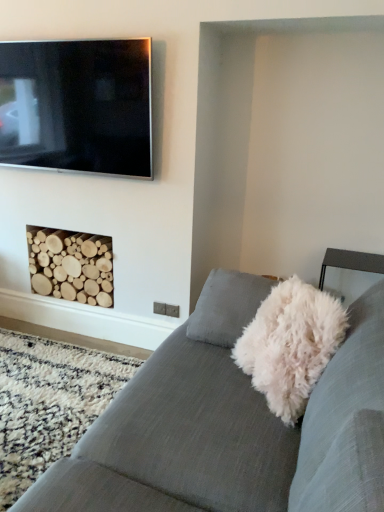
Question: From the image's perspective, is natural wood logs at lower left over flat screen tv at upper left?

Choices:
 (A) no
 (B) yes

Answer: (A)

Question: Is natural wood logs at lower left shorter than flat screen tv at upper left?

Choices:
 (A) no
 (B) yes

Answer: (B)

Question: Is natural wood logs at lower left aimed at flat screen tv at upper left?

Choices:
 (A) yes
 (B) no

Answer: (B)

Question: Does natural wood logs at lower left lie in front of flat screen tv at upper left?

Choices:
 (A) yes
 (B) no

Answer: (B)

Question: Does natural wood logs at lower left have a greater height compared to flat screen tv at upper left?

Choices:
 (A) yes
 (B) no

Answer: (B)

Question: Considering the positions of point (39, 485) and point (76, 48), is point (39, 485) closer or farther from the camera than point (76, 48)?

Choices:
 (A) farther
 (B) closer

Answer: (B)

Question: Would you say textured gray couch at center is to the left or to the right of flat screen tv at upper left in the picture?

Choices:
 (A) left
 (B) right

Answer: (B)

Question: Is textured gray couch at center inside the boundaries of flat screen tv at upper left, or outside?

Choices:
 (A) inside
 (B) outside

Answer: (B)

Question: From the image's perspective, is textured gray couch at center above or below flat screen tv at upper left?

Choices:
 (A) below
 (B) above

Answer: (A)

Question: From a real-world perspective, relative to natural wood logs at lower left, is flat screen tv at upper left vertically above or below?

Choices:
 (A) below
 (B) above

Answer: (B)

Question: Considering the relative positions of flat screen tv at upper left and natural wood logs at lower left in the image provided, is flat screen tv at upper left to the left or to the right of natural wood logs at lower left?

Choices:
 (A) right
 (B) left

Answer: (A)

Question: Relative to natural wood logs at lower left, is flat screen tv at upper left in front or behind?

Choices:
 (A) behind
 (B) front

Answer: (B)

Question: In terms of width, does flat screen tv at upper left look wider or thinner when compared to natural wood logs at lower left?

Choices:
 (A) wide
 (B) thin

Answer: (B)

Question: Is natural wood logs at lower left wider or thinner than flat screen tv at upper left?

Choices:
 (A) wide
 (B) thin

Answer: (A)

Question: From a real-world perspective, relative to flat screen tv at upper left, is natural wood logs at lower left vertically above or below?

Choices:
 (A) above
 (B) below

Answer: (B)